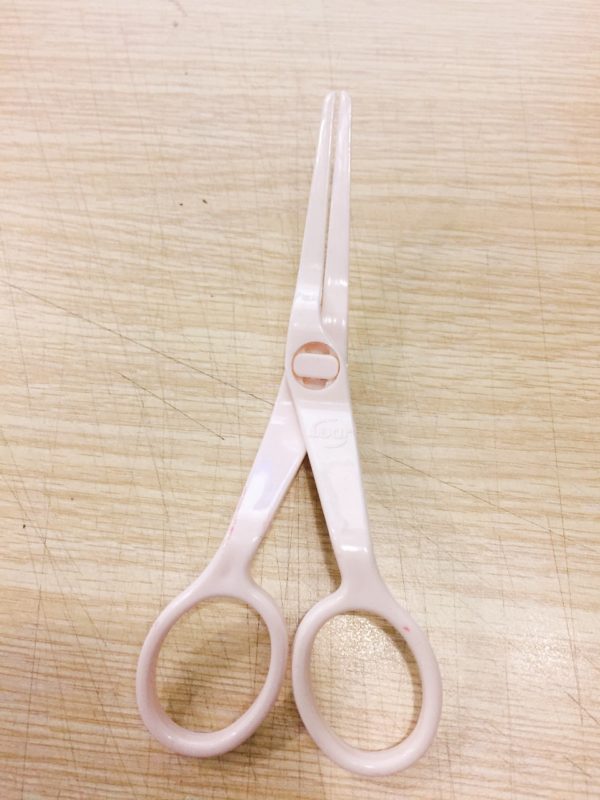
This screenshot has height=800, width=600. Identify the location of hook. (438, 693).